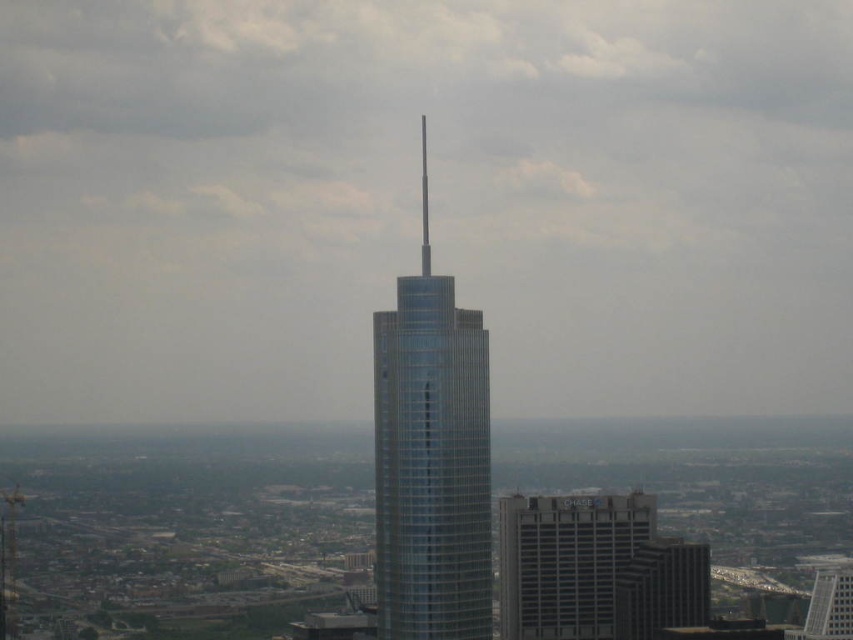
Does glassy silver tower at center have a smaller size compared to glassy silver skyscraper at lower right?

No.

Locate an element on the screen. glassy silver tower at center is located at coordinates (431, 460).

Between point (608, 536) and point (693, 564), which one is positioned in front?

Positioned in front is point (608, 536).

Locate an element on the screen. The image size is (853, 640). gray concrete building at lower center is located at coordinates (566, 561).

Based on the photo, between glassy silver tower at center and gray concrete building at lower center, which one has less height?

With less height is gray concrete building at lower center.

Between glassy silver tower at center and gray concrete building at lower center, which one is positioned lower?

Positioned lower is gray concrete building at lower center.

What do you see at coordinates (431, 460) in the screenshot? The image size is (853, 640). I see `glassy silver tower at center` at bounding box center [431, 460].

This screenshot has height=640, width=853. In order to click on glassy silver tower at center in this screenshot , I will do `click(431, 460)`.